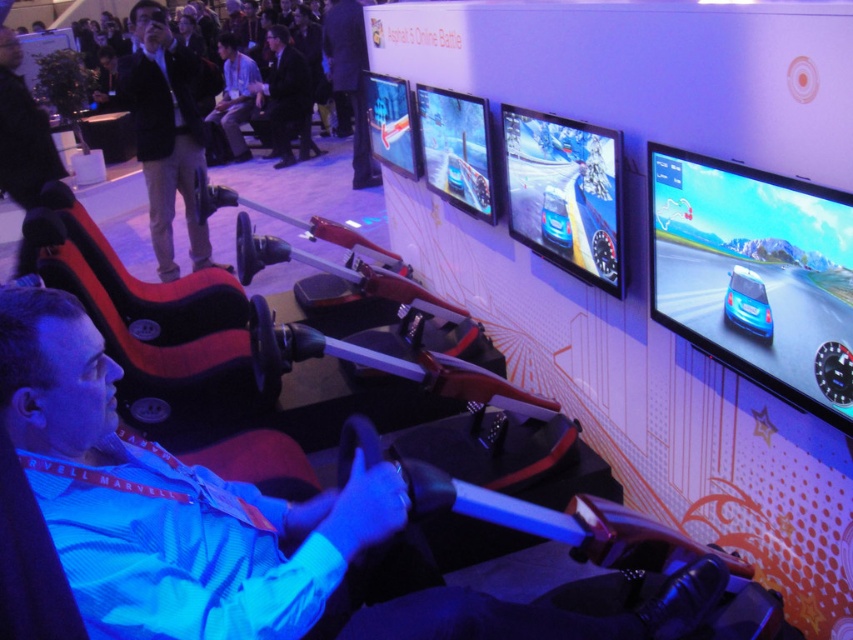
Question: Estimate the real-world distances between objects in this image. Which object is farther from the dark suit at upper center?

Choices:
 (A) blue fabric shirt at center
 (B) glossy blue car at center

Answer: (A)

Question: Which of the following is the farthest from the observer?

Choices:
 (A) black leather jacket at upper left
 (B) blue fabric shirt at center
 (C) blue glossy car at center
 (D) dark suit at upper center

Answer: (D)

Question: Can you confirm if blue fabric shirt at center is thinner than dark suit at upper center?

Choices:
 (A) yes
 (B) no

Answer: (B)

Question: Which of these objects is positioned closest to the glossy blue car at center?

Choices:
 (A) blue glossy car at center
 (B) blue fabric shirt at center
 (C) black leather jacket at upper left
 (D) dark suit at upper center

Answer: (A)

Question: Can you confirm if blue fabric shirt at center is thinner than glossy blue car at center?

Choices:
 (A) no
 (B) yes

Answer: (A)

Question: Is blue fabric shirt at center smaller than black leather jacket at upper left?

Choices:
 (A) yes
 (B) no

Answer: (A)